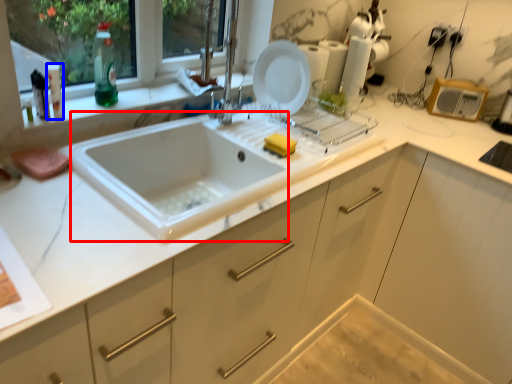
Question: Which object is closer to the camera taking this photo, sink (highlighted by a red box) or bottle (highlighted by a blue box)?

Choices:
 (A) sink
 (B) bottle

Answer: (A)